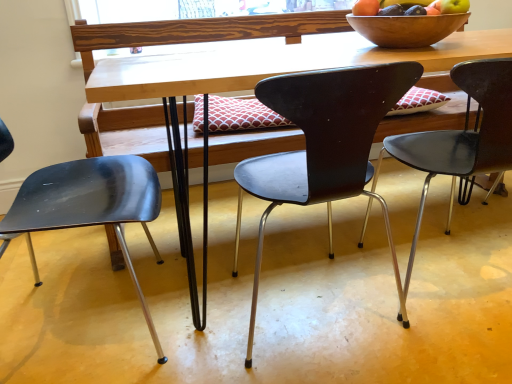
At what (x,y) coordinates should I click in order to perform the action: click on free spot below wooden desk at center (from a real-world perspective). Please return your answer as a coordinate pair (x, y). Looking at the image, I should click on (346, 241).